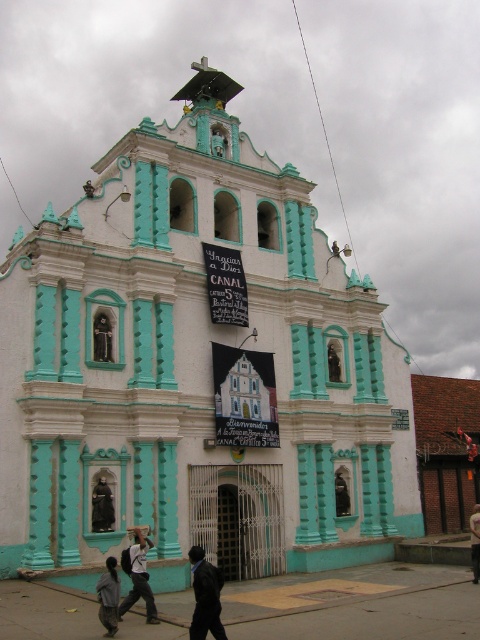
What do you see at coordinates (101, 506) in the screenshot? This screenshot has height=640, width=480. I see `matte black statue at lower left` at bounding box center [101, 506].

Which of these two, matte black statue at lower left or black fabric at center, stands shorter?

A: matte black statue at lower left is shorter.

Does point (95, 486) lie behind point (474, 529)?

No.

What are the coordinates of `matte black statue at lower left` in the screenshot? It's located at (101, 506).

Is dark gray fabric jacket at lower left closer to camera compared to matte black statue at lower left?

Yes, dark gray fabric jacket at lower left is in front of matte black statue at lower left.

The width and height of the screenshot is (480, 640). Describe the element at coordinates (108, 596) in the screenshot. I see `dark gray fabric jacket at lower left` at that location.

Where is `dark gray fabric jacket at lower left`? The width and height of the screenshot is (480, 640). dark gray fabric jacket at lower left is located at coordinates (108, 596).

Which of these two, white cotton shirt at center or matte black statue at lower left, stands taller?

Standing taller between the two is matte black statue at lower left.

Is white cotton shirt at center taller than matte black statue at lower left?

In fact, white cotton shirt at center may be shorter than matte black statue at lower left.

Does point (143, 570) lie in front of point (96, 515)?

Yes, point (143, 570) is closer to viewer.

You are a GUI agent. You are given a task and a screenshot of the screen. Output one action in this format:
    pyautogui.click(x=<x>, y=<y>)
    Task: Click on the white cotton shirt at center
    Image resolution: width=480 pixels, height=640 pixels.
    Given the screenshot: What is the action you would take?
    pyautogui.click(x=137, y=577)